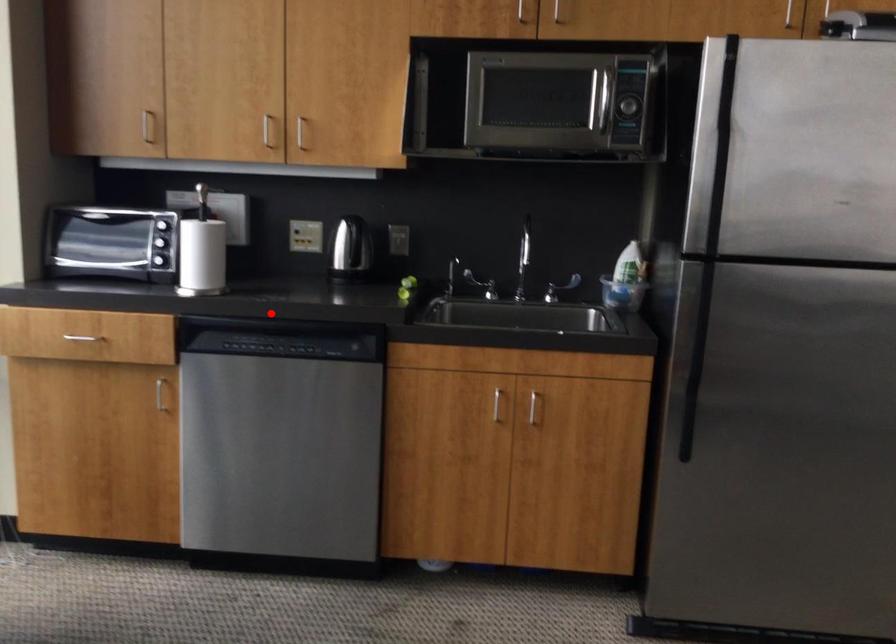
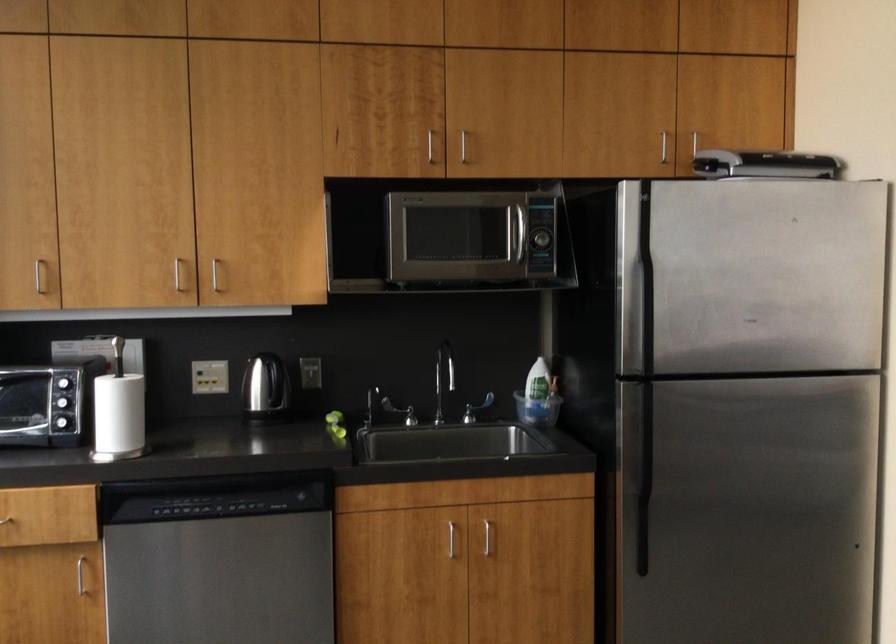
Find the pixel in the second image that matches the highlighted location in the first image.

(208, 471)